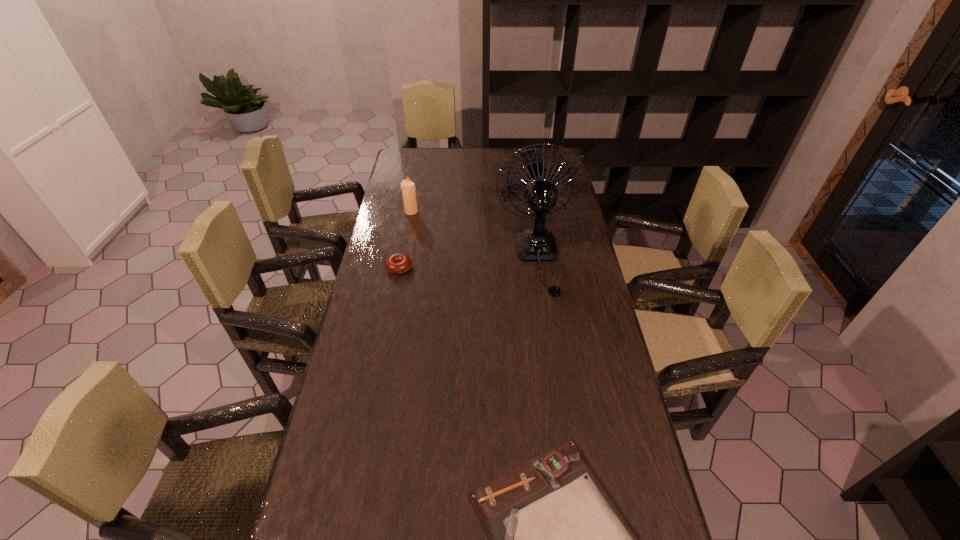
Where is `vacant point at the far edge`? This screenshot has height=540, width=960. vacant point at the far edge is located at coordinates (487, 153).

I want to click on vacant space at the left edge, so click(391, 189).

Image resolution: width=960 pixels, height=540 pixels. I want to click on free space at the right edge of the desktop, so click(558, 186).

Where is `vacant space at the far left corner of the desktop`? The width and height of the screenshot is (960, 540). vacant space at the far left corner of the desktop is located at coordinates (401, 174).

Where is `empty space between the farthest object and the tallest object`? The width and height of the screenshot is (960, 540). empty space between the farthest object and the tallest object is located at coordinates (474, 234).

Locate an element on the screen. vacant area between the doughnut and the tallest object is located at coordinates coord(468,262).

Locate an element on the screen. The height and width of the screenshot is (540, 960). empty location between the fan and the doughnut is located at coordinates (468, 262).

Image resolution: width=960 pixels, height=540 pixels. Identify the location of object that is the third closest to the tallest object. (557, 538).

Identify which object is the second nearest to the candle. Please provide its 2D coordinates. Your answer should be formatted as a tuple, i.e. [(x, y)], where the tuple contains the x and y coordinates of a point satisfying the conditions above.

[(533, 244)]